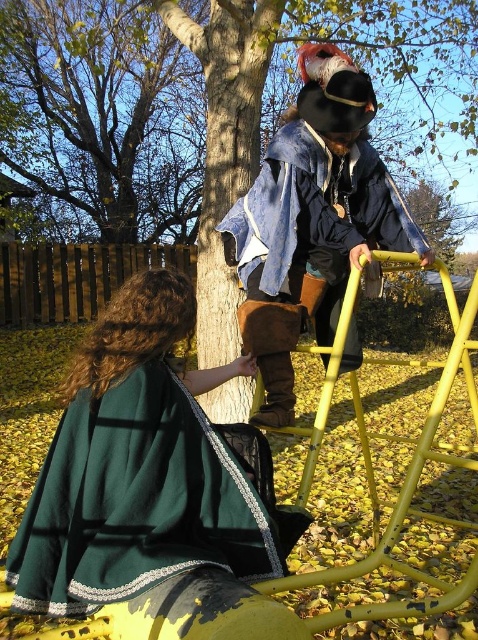
You are a costume designer observing the autumn backyard scene. You notice the green wool cape at lower left and the denim fabric pirate at upper center. Which costume is shorter in height?

The green wool cape at lower left has a lesser height compared to the denim fabric pirate at upper center, so the green wool cape at lower left is shorter in height.

You are standing in the backyard and want to find the smooth bark tree at center. Based on the coordinates provided, where should you look?

The smooth bark tree at center is located at coordinates point (210, 109).